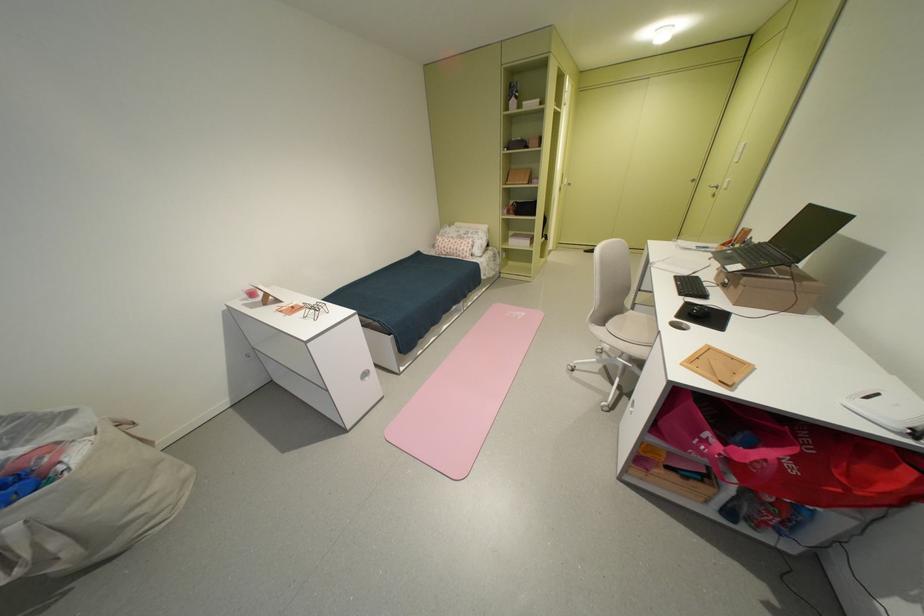
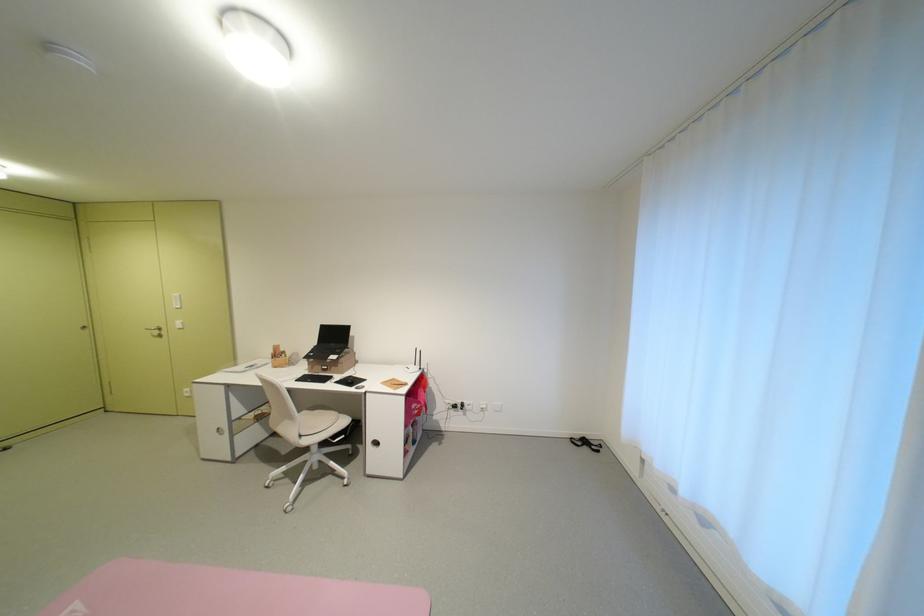
Locate, in the second image, the point that corresponds to pixel 746 288 in the first image.

(346, 368)